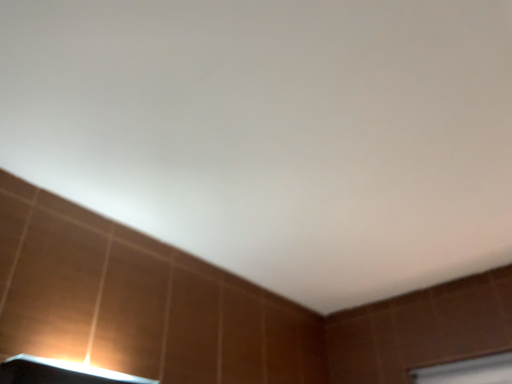
Question: Can you confirm if matte white lamp at lower left is positioned to the left of brown wooden window frame at lower right?

Choices:
 (A) no
 (B) yes

Answer: (B)

Question: Is matte white lamp at lower left in contact with brown wooden window frame at lower right?

Choices:
 (A) no
 (B) yes

Answer: (A)

Question: Could you tell me if matte white lamp at lower left is facing brown wooden window frame at lower right?

Choices:
 (A) yes
 (B) no

Answer: (B)

Question: Does matte white lamp at lower left have a lesser width compared to brown wooden window frame at lower right?

Choices:
 (A) no
 (B) yes

Answer: (A)

Question: Is matte white lamp at lower left oriented away from brown wooden window frame at lower right?

Choices:
 (A) no
 (B) yes

Answer: (A)

Question: Is the position of matte white lamp at lower left less distant than that of brown wooden window frame at lower right?

Choices:
 (A) yes
 (B) no

Answer: (A)

Question: Could you tell me if brown wooden window frame at lower right is facing matte white lamp at lower left?

Choices:
 (A) no
 (B) yes

Answer: (B)

Question: Does brown wooden window frame at lower right have a greater width compared to matte white lamp at lower left?

Choices:
 (A) no
 (B) yes

Answer: (A)

Question: Are brown wooden window frame at lower right and matte white lamp at lower left far apart?

Choices:
 (A) yes
 (B) no

Answer: (A)

Question: Does brown wooden window frame at lower right have a larger size compared to matte white lamp at lower left?

Choices:
 (A) no
 (B) yes

Answer: (A)

Question: Is brown wooden window frame at lower right behind matte white lamp at lower left?

Choices:
 (A) yes
 (B) no

Answer: (A)

Question: Is brown wooden window frame at lower right facing away from matte white lamp at lower left?

Choices:
 (A) no
 (B) yes

Answer: (A)

Question: In terms of size, does brown wooden window frame at lower right appear bigger or smaller than matte white lamp at lower left?

Choices:
 (A) big
 (B) small

Answer: (B)